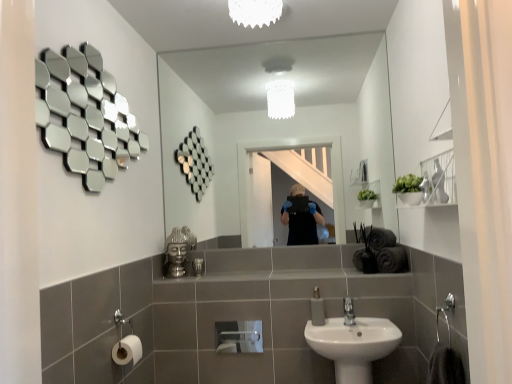
Question: From a real-world perspective, is shiny metallic hexagons at upper left, which is the 1th mirror in left-to-right order, located higher than silver metallic faucet at lower center?

Choices:
 (A) no
 (B) yes

Answer: (B)

Question: Can you confirm if shiny metallic hexagons at upper left, which is the 1th mirror in left-to-right order, is shorter than silver metallic faucet at lower center?

Choices:
 (A) no
 (B) yes

Answer: (A)

Question: Considering the relative sizes of shiny metallic hexagons at upper left, marked as the second mirror in a right-to-left arrangement, and silver metallic faucet at lower center in the image provided, is shiny metallic hexagons at upper left, marked as the second mirror in a right-to-left arrangement, wider than silver metallic faucet at lower center?

Choices:
 (A) yes
 (B) no

Answer: (B)

Question: Is shiny metallic hexagons at upper left, the 2th mirror in the back-to-front sequence, positioned behind silver metallic faucet at lower center?

Choices:
 (A) no
 (B) yes

Answer: (A)

Question: Is silver metallic faucet at lower center completely or partially inside shiny metallic hexagons at upper left, which is the 1th mirror in left-to-right order?

Choices:
 (A) yes
 (B) no

Answer: (B)

Question: Would you say clear glass mirror at center, the first mirror viewed from the right, is to the left or to the right of white frosted glass light fixture at upper center in the picture?

Choices:
 (A) right
 (B) left

Answer: (A)

Question: Relative to white frosted glass light fixture at upper center, is clear glass mirror at center, the second mirror viewed from the front, in front or behind?

Choices:
 (A) front
 (B) behind

Answer: (B)

Question: Based on their sizes in the image, would you say clear glass mirror at center, which is the 2th mirror from left to right, is bigger or smaller than white frosted glass light fixture at upper center?

Choices:
 (A) small
 (B) big

Answer: (B)

Question: Is clear glass mirror at center, the first mirror viewed from the right, taller or shorter than white frosted glass light fixture at upper center?

Choices:
 (A) tall
 (B) short

Answer: (A)

Question: Is white frosted glass light fixture at upper center in front of or behind white matte toilet paper at lower left, the first toilet paper from the back, in the image?

Choices:
 (A) front
 (B) behind

Answer: (A)

Question: From a real-world perspective, relative to white matte toilet paper at lower left, which is counted as the 2th toilet paper, starting from the left, is white frosted glass light fixture at upper center vertically above or below?

Choices:
 (A) above
 (B) below

Answer: (A)

Question: From the image's perspective, is white frosted glass light fixture at upper center located above or below white matte toilet paper at lower left, which is counted as the 2th toilet paper, starting from the left?

Choices:
 (A) above
 (B) below

Answer: (A)

Question: Is white frosted glass light fixture at upper center situated inside white matte toilet paper at lower left, which is the 1th toilet paper in right-to-left order, or outside?

Choices:
 (A) inside
 (B) outside

Answer: (B)

Question: Considering the positions of white frosted glass light fixture at upper center and metallic silver toiletry at center in the image, is white frosted glass light fixture at upper center bigger or smaller than metallic silver toiletry at center?

Choices:
 (A) big
 (B) small

Answer: (A)

Question: From their relative heights in the image, would you say white frosted glass light fixture at upper center is taller or shorter than metallic silver toiletry at center?

Choices:
 (A) short
 (B) tall

Answer: (B)